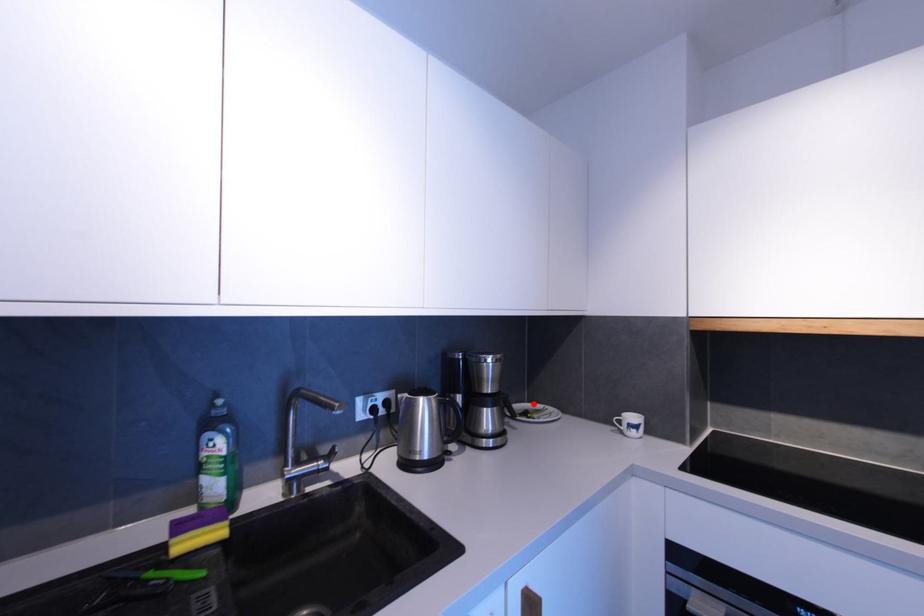
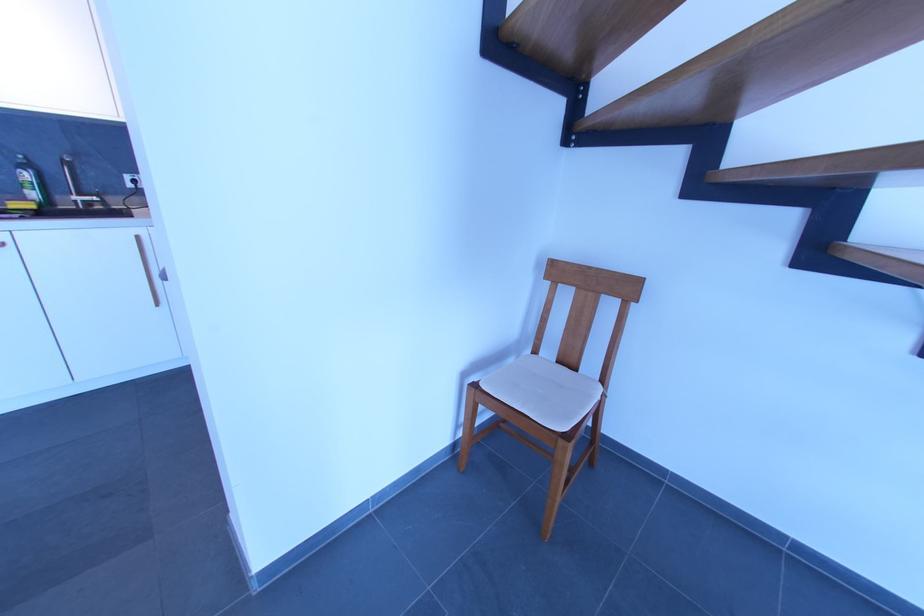
Question: I am providing you with two images of the same scene from different viewpoints. A red point is marked on the first image. Can you still see the location of the red point in image 2?

Choices:
 (A) Yes
 (B) No

Answer: (B)